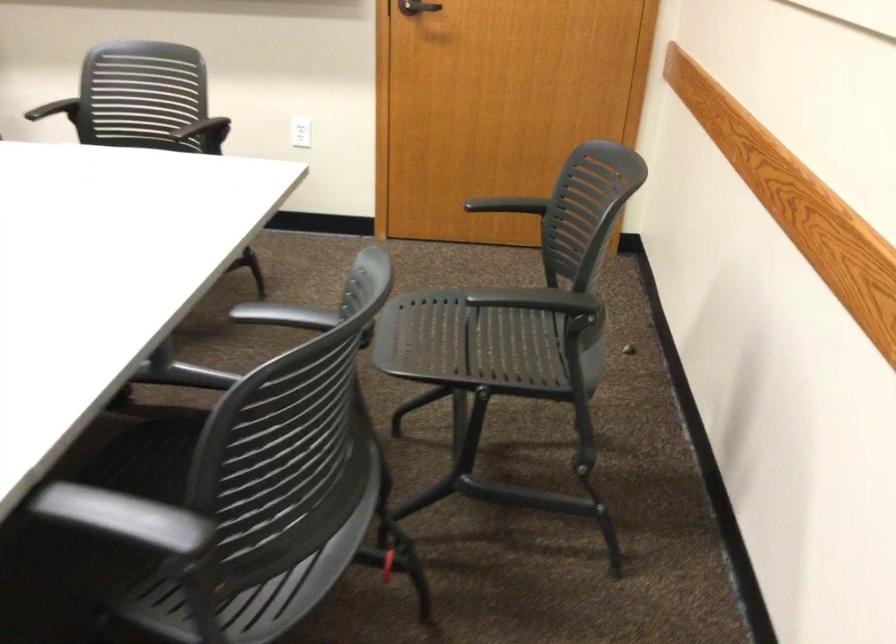
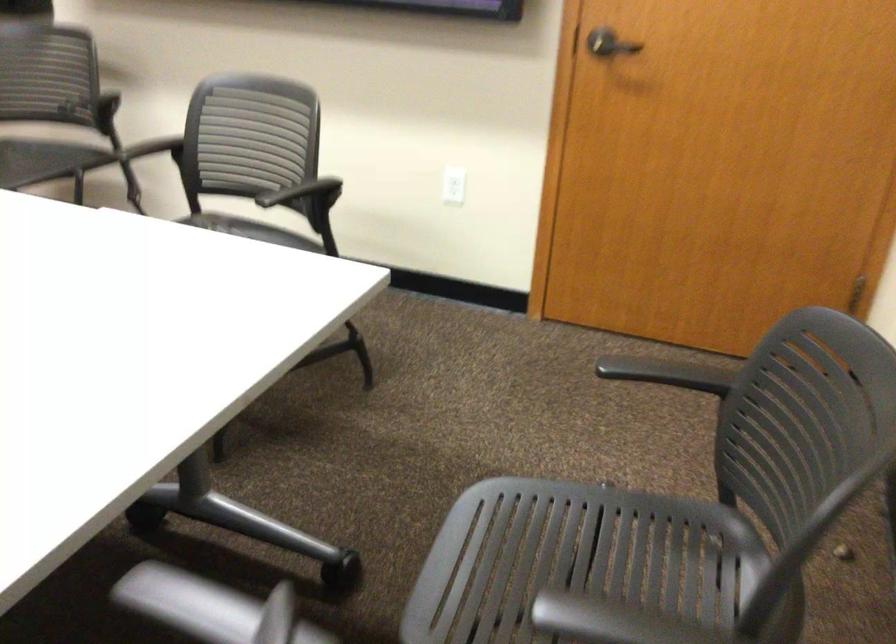
Question: How did the camera likely rotate?

Choices:
 (A) Left
 (B) Right
 (C) Up
 (D) Down

Answer: (A)